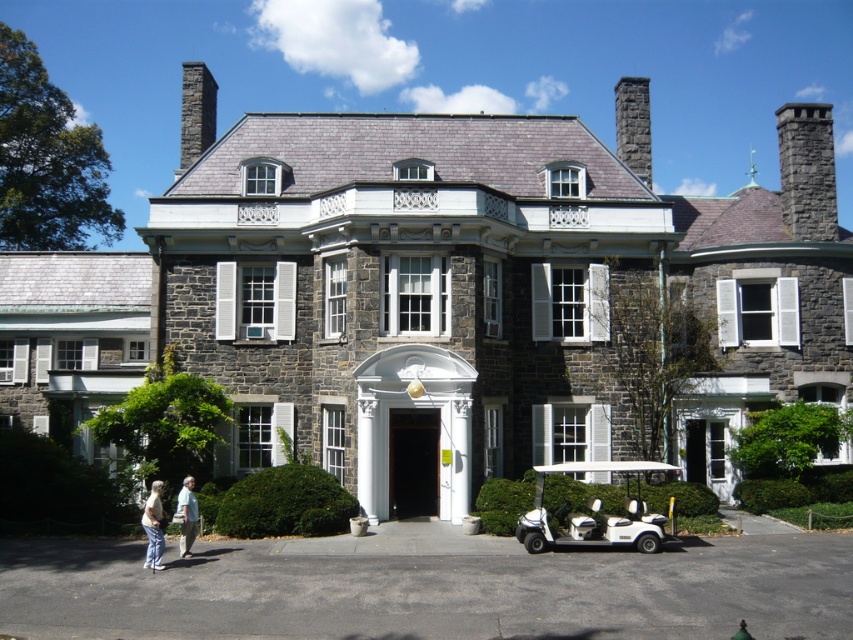
You are standing in front of the grand stone building. If you were to draw a straight line from your current position to the exact center of the building, would you hit the stone mansion at center?

Yes, the stone mansion at center is positioned at point (444, 298), so drawing a straight line to the exact center of the building would hit the stone mansion at center.

You are standing on the black asphalt at lower center looking up at the stone mansion at center. Which object is taller?

The stone mansion at center is taller than the black asphalt at lower center.

You are a visitor arriving at the stone mansion at center and need to park the white plastic golf cart at lower right. Given the size difference between them, will the golf cart fit in the mansion driveway without blocking the entrance?

The stone mansion at center is larger than the white plastic golf cart at lower right, so the golf cart should fit in the driveway without blocking the entrance.